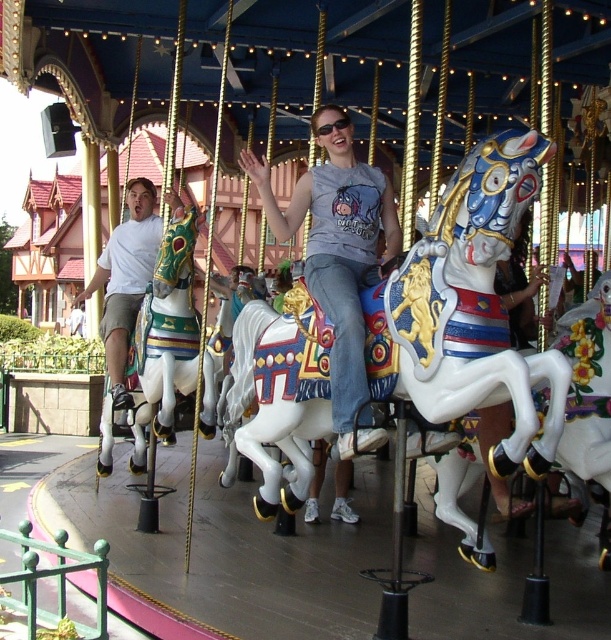
Is white glossy horse at center bigger than matte gray shirt at center?

Indeed, white glossy horse at center has a larger size compared to matte gray shirt at center.

Between white glossy horse at center and matte gray shirt at center, which one is positioned higher?

matte gray shirt at center is higher up.

Is point (384, 380) farther from viewer compared to point (290, 211)?

No, (384, 380) is closer to viewer.

Find the location of a particular element. This screenshot has width=611, height=640. white glossy horse at center is located at coordinates (467, 307).

Is white glossy horse at center thinner than white matte shirt at left?

Incorrect, white glossy horse at center's width is not less than white matte shirt at left's.

Between white glossy horse at center and white matte shirt at left, which one has less height?

Standing shorter between the two is white matte shirt at left.

The image size is (611, 640). Identify the location of white glossy horse at center. (467, 307).

Between point (177, 208) and point (115, 349), which one is positioned in front?

Point (177, 208)

Find the location of a particular element. This screenshot has height=640, width=611. white glossy horse at left is located at coordinates (169, 340).